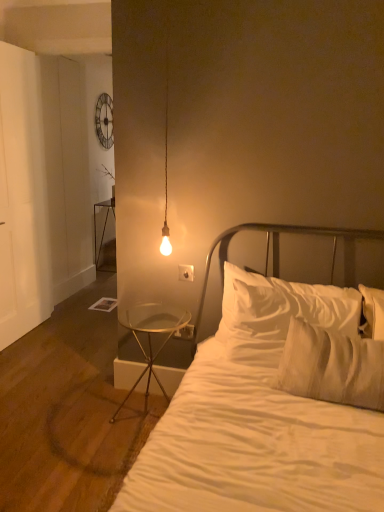
Where is `white plastic electric outlet at center, which is the second electric outlet from back to front`? This screenshot has height=512, width=384. white plastic electric outlet at center, which is the second electric outlet from back to front is located at coordinates (186, 272).

What do you see at coordinates (104, 223) in the screenshot? I see `metallic glass table at left, which appears as the 2th nightstand when viewed from the right` at bounding box center [104, 223].

What is the approximate height of white soft pillow at center?

white soft pillow at center is 22.43 inches tall.

Identify the location of white plastic electric outlet at center, which is the second electric outlet from back to front. Image resolution: width=384 pixels, height=512 pixels. (186, 272).

Is white plastic electric outlet at center, which is the second electric outlet from bottom to top, placed right next to clear glass table at lower left, which ranks as the second nightstand in back-to-front order?

No, white plastic electric outlet at center, which is the second electric outlet from bottom to top, is not with clear glass table at lower left, which ranks as the second nightstand in back-to-front order.

I want to click on the 1st electric outlet behind when counting from the clear glass table at lower left, acting as the 2th nightstand starting from the left, so click(x=186, y=272).

Does white plastic electric outlet at center, the 1th electric outlet viewed from the front, turn towards clear glass table at lower left, which ranks as the second nightstand in back-to-front order?

No, white plastic electric outlet at center, the 1th electric outlet viewed from the front, is not turned towards clear glass table at lower left, which ranks as the second nightstand in back-to-front order.

From the image's perspective, which is above, white plastic electric outlet at center, the 1th electric outlet viewed from the front, or clear glass table at lower left, positioned as the 1th nightstand in right-to-left order?

white plastic electric outlet at center, the 1th electric outlet viewed from the front.

Considering the sizes of objects white soft pillow at center and clear glass table at lower left, the 2th nightstand from the top, in the image provided, who is taller, white soft pillow at center or clear glass table at lower left, the 2th nightstand from the top,?

Standing taller between the two is clear glass table at lower left, the 2th nightstand from the top.

Could you tell me if white soft pillow at center is turned towards clear glass table at lower left, acting as the 2th nightstand starting from the left?

No, white soft pillow at center is not facing towards clear glass table at lower left, acting as the 2th nightstand starting from the left.

From the image's perspective, is white soft pillow at center above clear glass table at lower left, the 2th nightstand from the top?

Yes, from the image's perspective, white soft pillow at center is over clear glass table at lower left, the 2th nightstand from the top.

Is white plastic electric outlet at lower center, which ranks as the 1th electric outlet in back-to-front order, shorter than white soft pillow at center?

Correct, white plastic electric outlet at lower center, which ranks as the 1th electric outlet in back-to-front order, is not as tall as white soft pillow at center.

Consider the image. Is white plastic electric outlet at lower center, which is the second electric outlet in top-to-bottom order, positioned far away from white soft pillow at center?

No, white plastic electric outlet at lower center, which is the second electric outlet in top-to-bottom order, is not far from white soft pillow at center.

Considering the positions of objects white plastic electric outlet at lower center, placed as the second electric outlet when sorted from front to back, and white soft pillow at center in the image provided, who is more to the right, white plastic electric outlet at lower center, placed as the second electric outlet when sorted from front to back, or white soft pillow at center?

white soft pillow at center.

Is white soft pillow at center at the back of white plastic electric outlet at lower center, placed as the second electric outlet when sorted from front to back?

No, white soft pillow at center is not at the back of white plastic electric outlet at lower center, placed as the second electric outlet when sorted from front to back.

Find the location of a particular element. The width and height of the screenshot is (384, 512). bed on the right of clear glass table at lower left, the 2th nightstand from the top is located at coordinates (260, 409).

Considering the relative sizes of clear glass table at lower left, the 2th nightstand from the top, and white cotton bed at center in the image provided, is clear glass table at lower left, the 2th nightstand from the top, wider than white cotton bed at center?

No, clear glass table at lower left, the 2th nightstand from the top, is not wider than white cotton bed at center.

Consider the image. Is clear glass table at lower left, placed as the 1th nightstand when sorted from front to back, far away from white cotton bed at center?

They are positioned close to each other.

Is metallic glass table at left, which appears as the 2th nightstand when viewed from the right, smaller than white plastic electric outlet at lower center, which ranks as the 1th electric outlet in back-to-front order?

Incorrect, metallic glass table at left, which appears as the 2th nightstand when viewed from the right, is not smaller in size than white plastic electric outlet at lower center, which ranks as the 1th electric outlet in back-to-front order.

Considering the sizes of objects metallic glass table at left, the second nightstand when ordered from front to back, and white plastic electric outlet at lower center, which is the second electric outlet in top-to-bottom order, in the image provided, who is taller, metallic glass table at left, the second nightstand when ordered from front to back, or white plastic electric outlet at lower center, which is the second electric outlet in top-to-bottom order,?

metallic glass table at left, the second nightstand when ordered from front to back, is taller.

From the image's perspective, is metallic glass table at left, the second nightstand when ordered from front to back, located beneath white plastic electric outlet at lower center, which ranks as the 1th electric outlet in back-to-front order?

No.

Considering the points (99, 251) and (180, 332), which point is in front, point (99, 251) or point (180, 332)?

The point (180, 332) is closer.

Is white plastic electric outlet at lower center, which is the second electric outlet in top-to-bottom order, aimed at white cotton bed at center?

No, white plastic electric outlet at lower center, which is the second electric outlet in top-to-bottom order, is not facing towards white cotton bed at center.

From a real-world perspective, is white plastic electric outlet at lower center, which is the second electric outlet in top-to-bottom order, positioned above or below white cotton bed at center?

In terms of real-world spatial position, white plastic electric outlet at lower center, which is the second electric outlet in top-to-bottom order, is below white cotton bed at center.

Is white plastic electric outlet at lower center, the 1th electric outlet ordered from the bottom, bigger than white cotton bed at center?

Actually, white plastic electric outlet at lower center, the 1th electric outlet ordered from the bottom, might be smaller than white cotton bed at center.

Is white plastic electric outlet at lower center, which ranks as the 1th electric outlet in back-to-front order, in contact with white cotton bed at center?

No, white plastic electric outlet at lower center, which ranks as the 1th electric outlet in back-to-front order, is not in contact with white cotton bed at center.

From the image's perspective, relative to metallic glass table at left, the first nightstand from the left, is white soft pillow at center above or below?

white soft pillow at center is below metallic glass table at left, the first nightstand from the left.

Which point is more distant from viewer, (267, 293) or (106, 219)?

The point (106, 219) is more distant.

Does white soft pillow at center turn towards metallic glass table at left, the first nightstand from the left?

No, white soft pillow at center is not oriented towards metallic glass table at left, the first nightstand from the left.

Where is `nightstand in front of the white plastic electric outlet at center, which is the second electric outlet from bottom to top`? The height and width of the screenshot is (512, 384). nightstand in front of the white plastic electric outlet at center, which is the second electric outlet from bottom to top is located at coordinates (150, 336).

Identify the location of pillow on the right of clear glass table at lower left, positioned as the 1th nightstand in right-to-left order. (x=278, y=313).

When comparing their distances from clear glass table at lower left, positioned as the 1th nightstand in right-to-left order, does white plastic electric outlet at lower center, the 1th electric outlet ordered from the bottom, or white plastic electric outlet at center, which is the second electric outlet from bottom to top, seem closer?

white plastic electric outlet at lower center, the 1th electric outlet ordered from the bottom, is closer to clear glass table at lower left, positioned as the 1th nightstand in right-to-left order.

From the image, which object appears to be nearer to white plastic electric outlet at lower center, which ranks as the 1th electric outlet in back-to-front order, white cotton bed at center or clear glass table at lower left, positioned as the 1th nightstand in right-to-left order?

clear glass table at lower left, positioned as the 1th nightstand in right-to-left order.

Considering their positions, is white plastic electric outlet at lower center, the 1th electric outlet ordered from the bottom, positioned further to white soft pillow at center than white cotton bed at center?

Based on the image, white plastic electric outlet at lower center, the 1th electric outlet ordered from the bottom, appears to be further to white soft pillow at center.

Based on their spatial positions, is white plastic electric outlet at center, which is the second electric outlet from back to front, or white soft pillow at center closer to white cotton bed at center?

white soft pillow at center is positioned closer to the anchor white cotton bed at center.

In the scene shown: When comparing their distances from white cotton bed at center, does clear glass table at lower left, placed as the 1th nightstand when sorted from front to back, or white soft pillow at center seem closer?

The object closer to white cotton bed at center is white soft pillow at center.

When comparing their distances from white soft pillow at center, does clear glass table at lower left, which ranks as the second nightstand in back-to-front order, or white plastic electric outlet at lower center, which is the second electric outlet in top-to-bottom order, seem further?

white plastic electric outlet at lower center, which is the second electric outlet in top-to-bottom order.

Estimate the real-world distances between objects in this image. Which object is further from metallic glass table at left, placed as the 2th nightstand when sorted from bottom to top, white cotton bed at center or white soft pillow at center?

white cotton bed at center lies further to metallic glass table at left, placed as the 2th nightstand when sorted from bottom to top, than the other object.

Estimate the real-world distances between objects in this image. Which object is further from white plastic electric outlet at center, which is the second electric outlet from back to front, metallic glass table at left, the first nightstand from the left, or white cotton bed at center?

Among the two, metallic glass table at left, the first nightstand from the left, is located further to white plastic electric outlet at center, which is the second electric outlet from back to front.

Identify the location of nightstand between white cotton bed at center and white plastic electric outlet at lower center, which is the second electric outlet in top-to-bottom order, along the z-axis. The image size is (384, 512). (150, 336).

Find the location of `electric outlet located between white cotton bed at center and white plastic electric outlet at lower center, which ranks as the 1th electric outlet in back-to-front order, in the depth direction`. electric outlet located between white cotton bed at center and white plastic electric outlet at lower center, which ranks as the 1th electric outlet in back-to-front order, in the depth direction is located at coordinates (186, 272).

Image resolution: width=384 pixels, height=512 pixels. I want to click on nightstand between white soft pillow at center and metallic glass table at left, which appears as the 2th nightstand when viewed from the right, in the front-back direction, so click(150, 336).

The width and height of the screenshot is (384, 512). Identify the location of nightstand between white cotton bed at center and white plastic electric outlet at center, the 1th electric outlet viewed from the front, in the front-back direction. (150, 336).